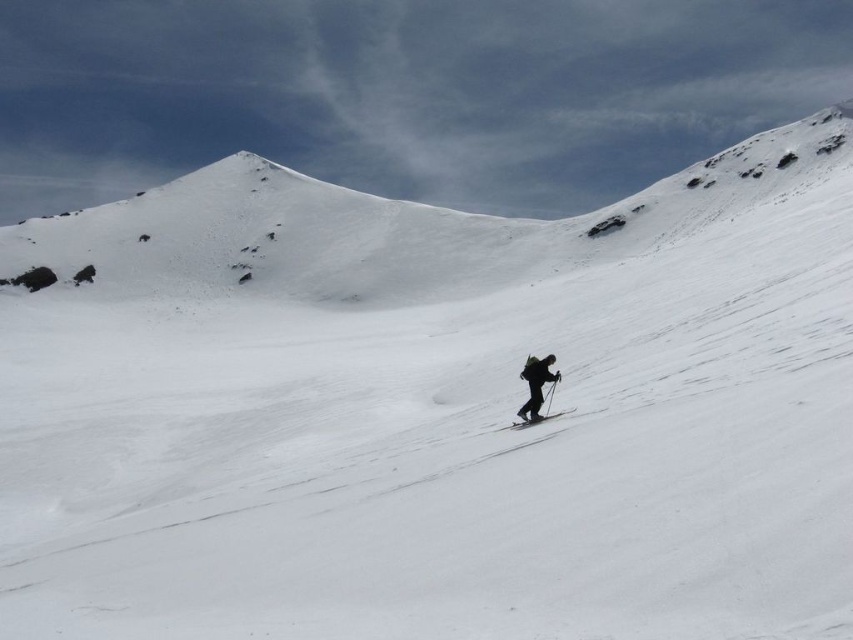
You are a drone operator trying to capture the white snow covered mountain at upper center. The drone has a camera with a 180 degree field of view. The drone is currently positioned at point (392, 228). Will the white snow covered mountain at upper center be in the camera frame?

The point (392, 228) corresponds to the white snow covered mountain at upper center, so yes, the mountain will be in the camera frame.